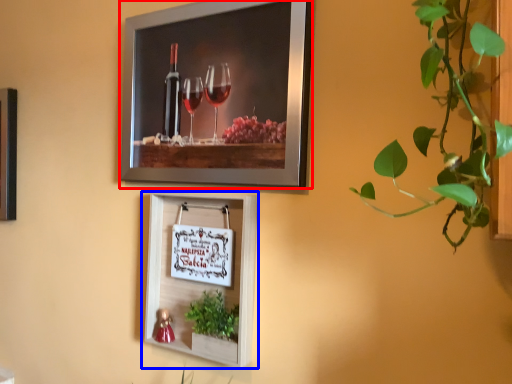
Question: Among these objects, which one is nearest to the camera, picture frame (highlighted by a red box) or picture frame (highlighted by a blue box)?

Choices:
 (A) picture frame
 (B) picture frame

Answer: (A)